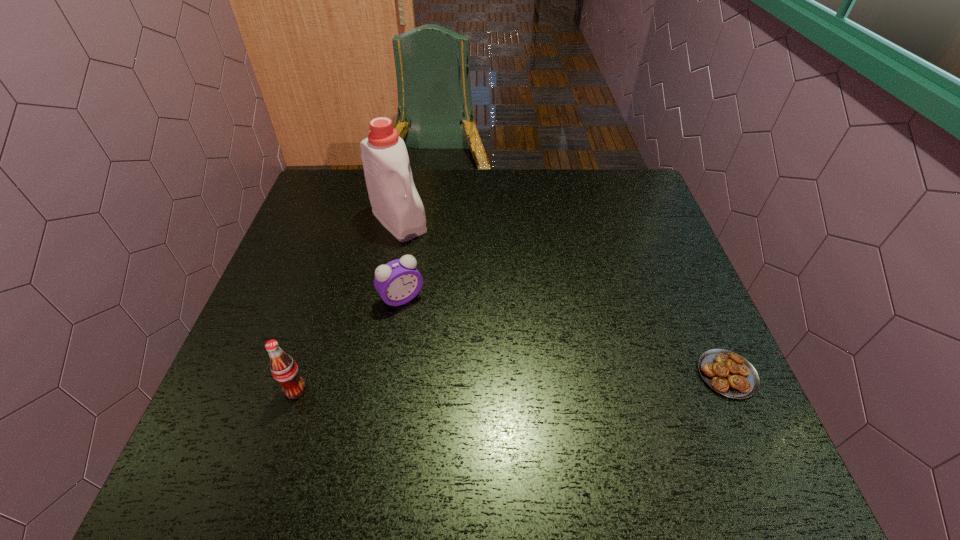
Identify the location of object that is at the right edge. (728, 373).

Image resolution: width=960 pixels, height=540 pixels. I want to click on object that is positioned at the near left corner, so click(x=284, y=369).

You are a GUI agent. You are given a task and a screenshot of the screen. Output one action in this format:
    pyautogui.click(x=<x>, y=<y>)
    Task: Click on the object that is positioned at the near right corner
    The image size is (960, 540).
    Given the screenshot: What is the action you would take?
    pyautogui.click(x=728, y=373)

Image resolution: width=960 pixels, height=540 pixels. Find the location of `free space at the far edge`. free space at the far edge is located at coordinates (499, 174).

Find the location of a particular element. The width and height of the screenshot is (960, 540). blank space at the near edge is located at coordinates (531, 404).

Identify the location of vacant area at the left edge of the desktop. This screenshot has height=540, width=960. (283, 264).

Find the location of a particular element. vacant space at the right edge is located at coordinates (620, 268).

Where is `free space at the far left corner of the desktop`? The width and height of the screenshot is (960, 540). free space at the far left corner of the desktop is located at coordinates (339, 191).

This screenshot has height=540, width=960. In the image, there is a desktop. What are the coordinates of `vacant space at the far right corner` in the screenshot? It's located at (629, 172).

You are a GUI agent. You are given a task and a screenshot of the screen. Output one action in this format:
    pyautogui.click(x=<x>, y=<y>)
    Task: Click on the blank space at the near right corner of the desktop
    
    Given the screenshot: What is the action you would take?
    pyautogui.click(x=688, y=389)